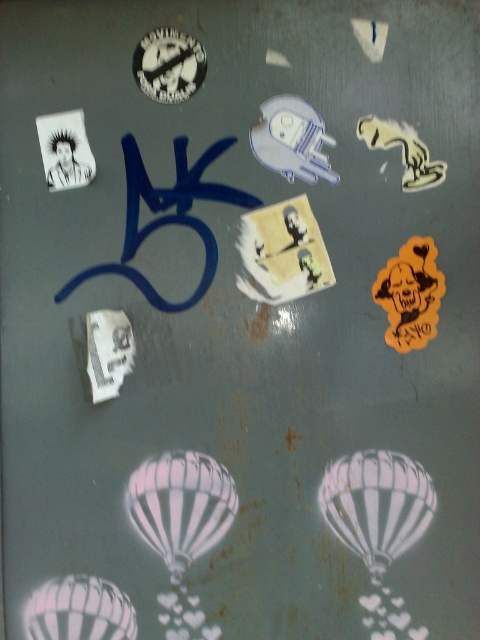
You are holding a measuring tape and need to determine the distance between the two white striped balloons. According to the image, how far apart are the white striped balloon at center and the white striped balloon at lower left?

The white striped balloon at center is 8.41 inches away from the white striped balloon at lower left.